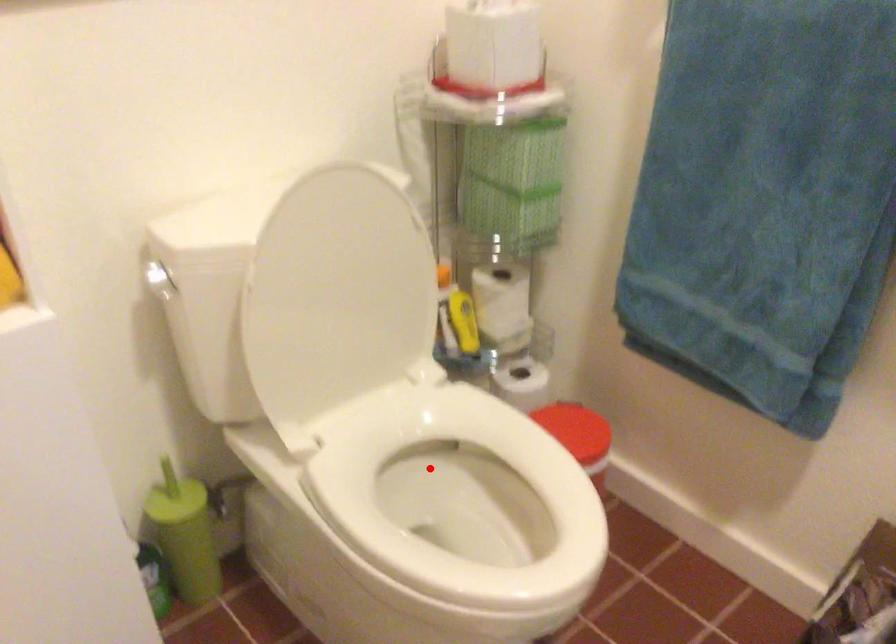
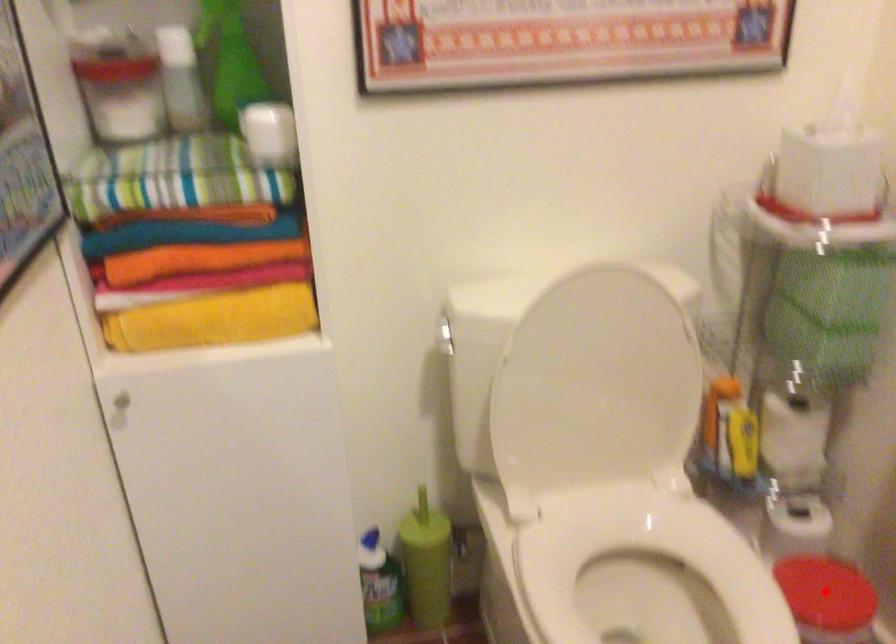
I am providing you with two images of the same scene from different viewpoints. A red point is marked on the first image and another point is marked on the second image. Is the red point in image1 aligned with the point shown in image2?

No